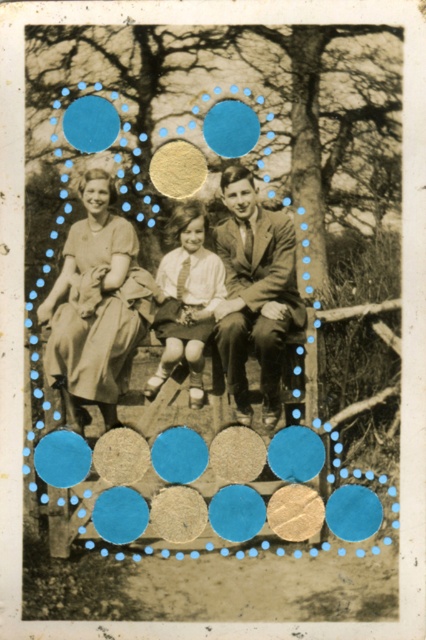
Which is above, matte brown suit at center or matte yellow circle at center?

matte yellow circle at center is above.

Is matte brown suit at center bigger than matte yellow circle at center?

Yes.

Between point (273, 227) and point (169, 189), which one is positioned in front?

Point (273, 227)

Find the location of a particular element. matte brown suit at center is located at coordinates (92, 314).

Who is positioned more to the right, matte white shirt at center or matte yellow circle at center?

From the viewer's perspective, matte white shirt at center appears more on the right side.

In the scene shown: Between matte white shirt at center and matte yellow circle at center, which one is positioned higher?

matte yellow circle at center is higher up.

I want to click on matte white shirt at center, so click(187, 300).

Which of these two, smooth brown suit at center or matte white shirt at center, stands taller?

Standing taller between the two is smooth brown suit at center.

Is smooth brown suit at center smaller than matte white shirt at center?

No.

Who is more forward, (239, 324) or (209, 320)?

→ Point (209, 320)

Locate an element on the screen. The width and height of the screenshot is (426, 640). smooth brown suit at center is located at coordinates (255, 291).